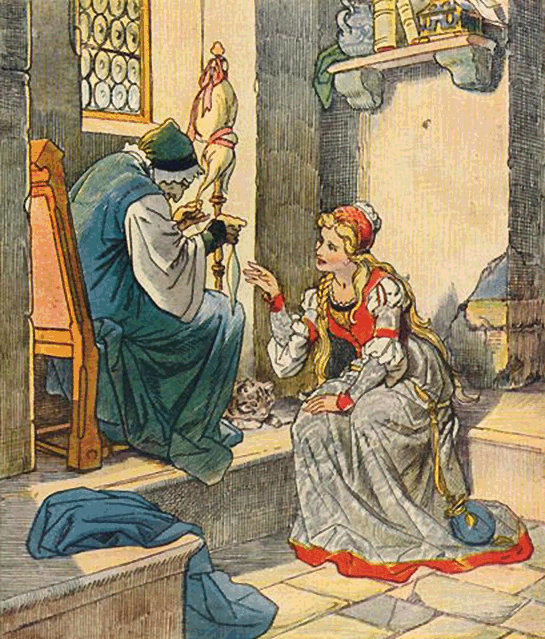
Identify the location of columns. click(x=305, y=135), click(x=522, y=147), click(x=24, y=404).